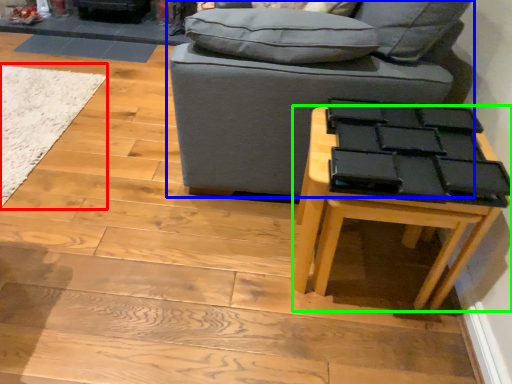
Question: Which is nearer to the mat (highlighted by a red box)? studio couch (highlighted by a blue box) or table (highlighted by a green box).

Choices:
 (A) studio couch
 (B) table

Answer: (A)